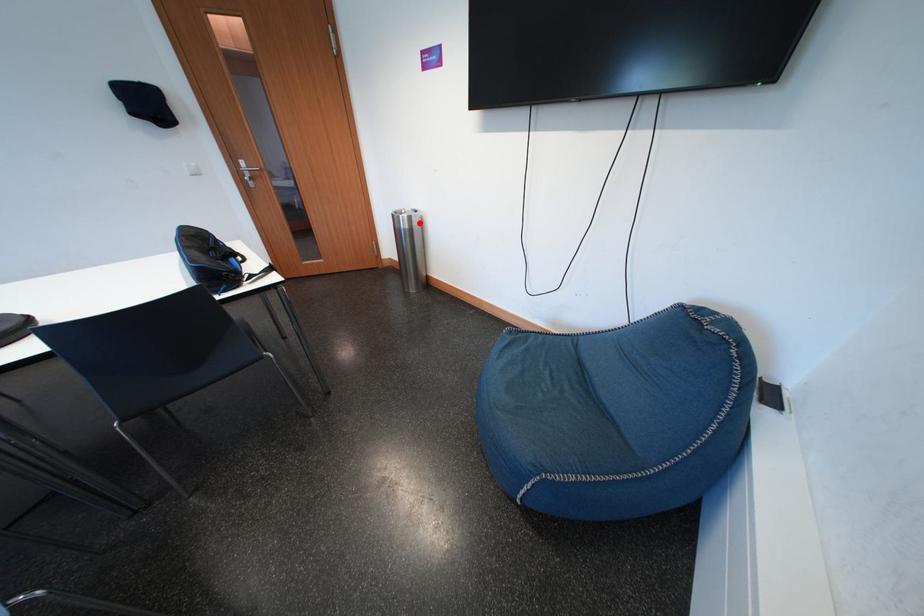
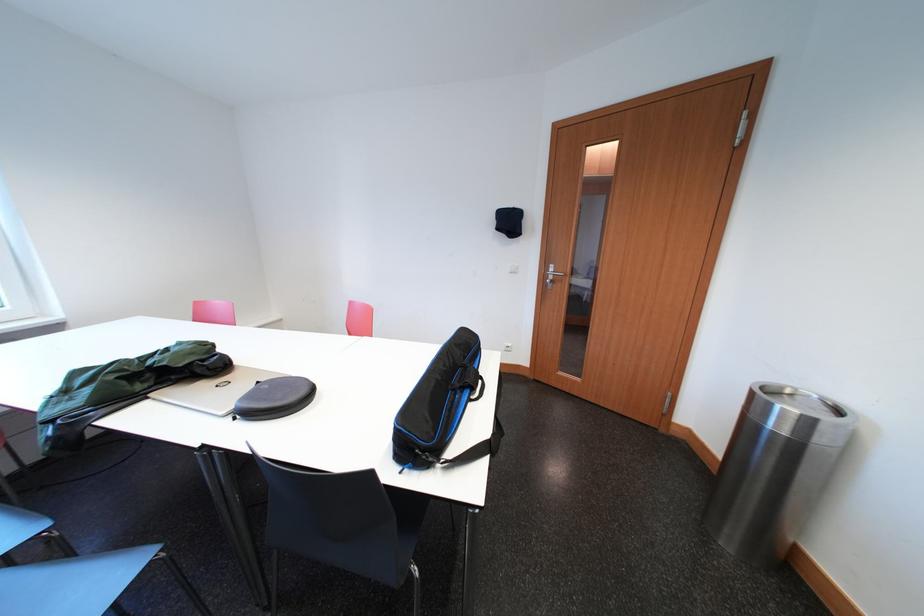
Locate, in the second image, the point that corresponds to the highlighted location in the first image.

(819, 426)